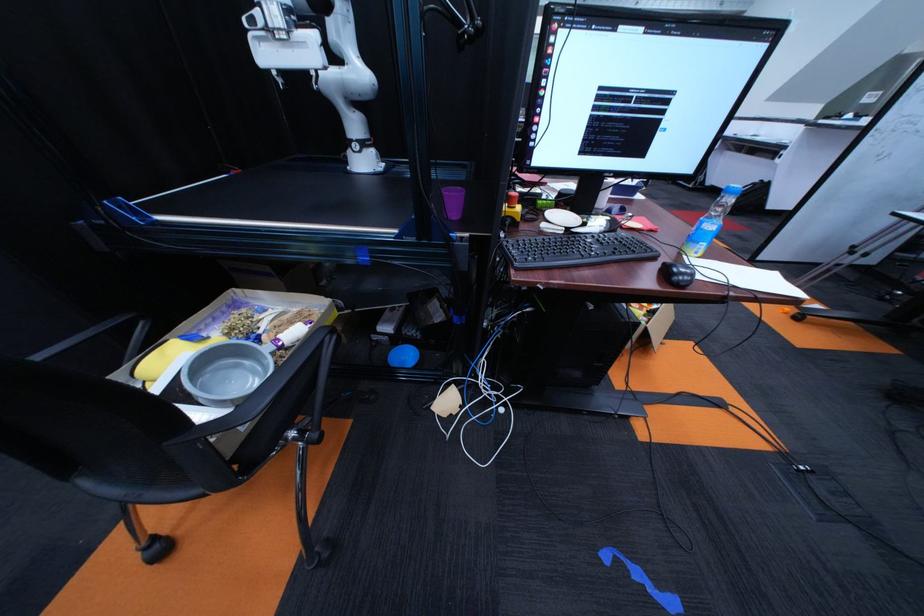
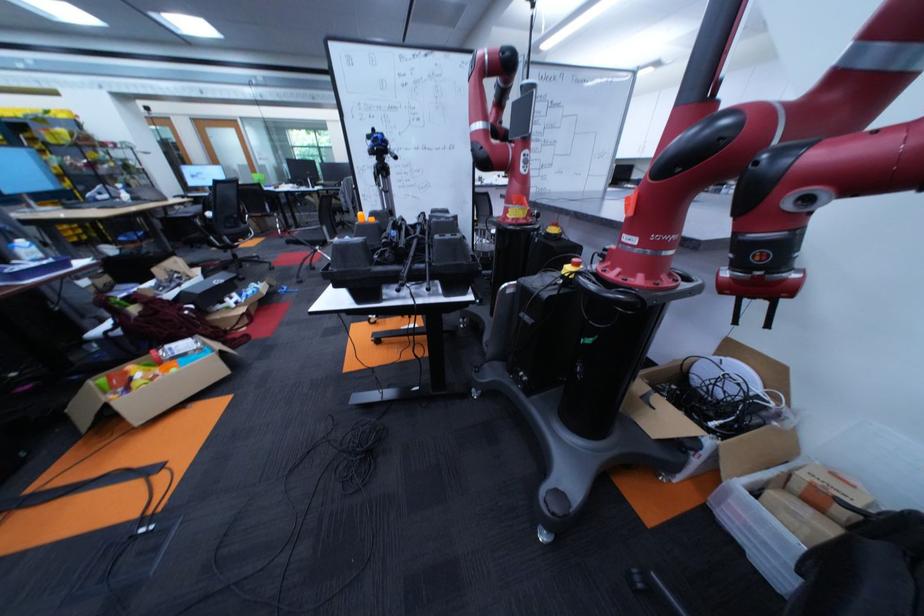
Question: In a continuous first-person perspective shot, in which direction is the camera moving?

Choices:
 (A) Left
 (B) Right
 (C) Forward
 (D) Backward

Answer: (B)